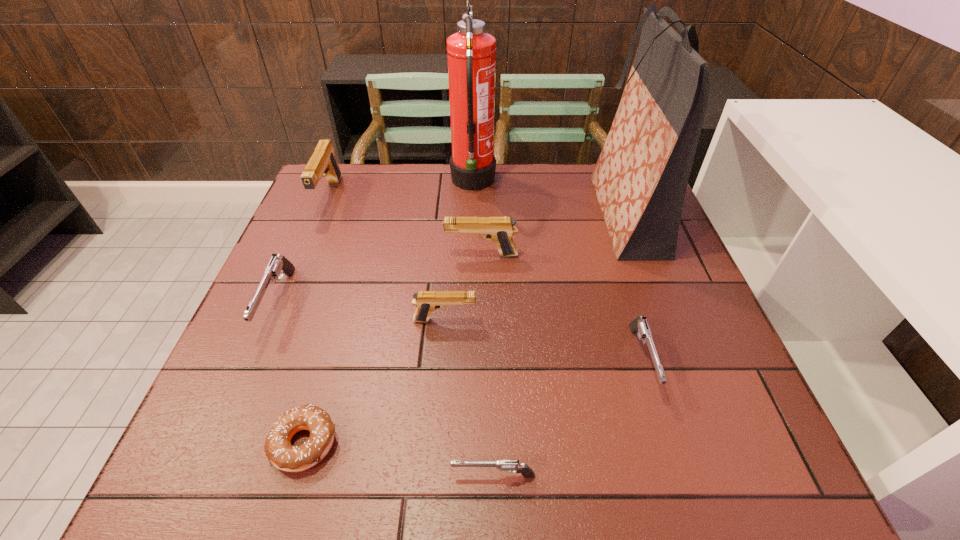
This screenshot has width=960, height=540. I want to click on the smallest silver pistol, so click(511, 466).

Locate an element on the screen. the second shortest object is located at coordinates (511, 466).

The height and width of the screenshot is (540, 960). In order to click on the seventh object from right to left in this screenshot , I will do `click(278, 449)`.

The height and width of the screenshot is (540, 960). Identify the location of the shortest object. (278, 449).

Where is `vacant area situated 0.340m on the front-facing side of the fire extinguisher`? The height and width of the screenshot is (540, 960). vacant area situated 0.340m on the front-facing side of the fire extinguisher is located at coordinates (610, 183).

Where is `vacant region located on the front-facing side of the shopping bag`? This screenshot has height=540, width=960. vacant region located on the front-facing side of the shopping bag is located at coordinates (507, 214).

Where is `free location located on the front-facing side of the shopping bag`? Image resolution: width=960 pixels, height=540 pixels. free location located on the front-facing side of the shopping bag is located at coordinates (537, 214).

Identify the location of vacant space located 0.050m on the front-facing side of the shopping bag. This screenshot has width=960, height=540. (569, 214).

You are a GUI agent. You are given a task and a screenshot of the screen. Output one action in this format:
    pyautogui.click(x=<x>, y=<y>)
    Task: Click on the free space located at the barrel of the farthest pistol
    Image resolution: width=960 pixels, height=540 pixels.
    Given the screenshot: What is the action you would take?
    pyautogui.click(x=300, y=268)

Where is `free space located at the barrel of the fourth tallest object`? free space located at the barrel of the fourth tallest object is located at coordinates pyautogui.click(x=304, y=255).